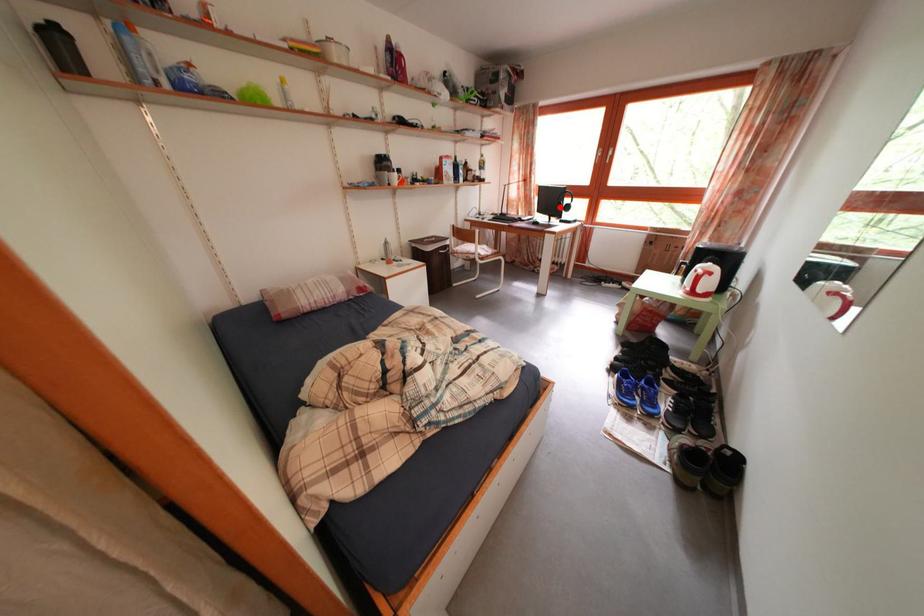
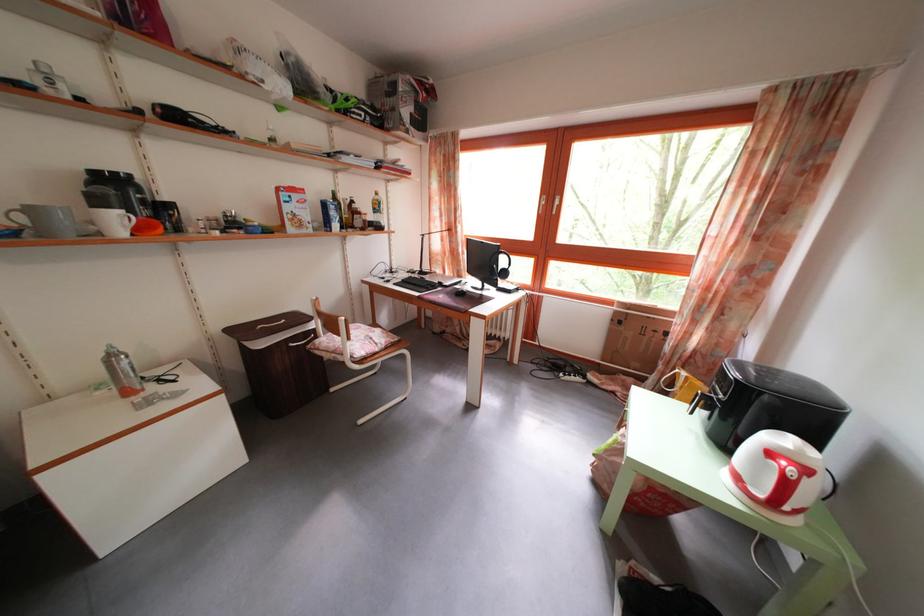
Where in the second image is the point corresponding to the highlighted location from the first image?

(492, 265)